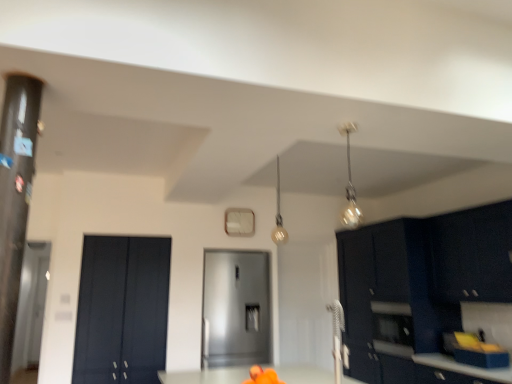
Question: Is matte gold light fixture at upper center, which ranks as the 1th light fixture in back-to-front order, a part of matte black cabinet at left, the 1th door when ordered from left to right?

Choices:
 (A) no
 (B) yes

Answer: (A)

Question: Can you confirm if matte black cabinet at left, the 1th door when ordered from left to right, is shorter than matte gold light fixture at upper center, placed as the 2th light fixture when sorted from front to back?

Choices:
 (A) no
 (B) yes

Answer: (A)

Question: Is matte black cabinet at left, the 1th door when ordered from left to right, facing away from matte gold light fixture at upper center, which ranks as the 1th light fixture in back-to-front order?

Choices:
 (A) yes
 (B) no

Answer: (B)

Question: Is matte black cabinet at left, the 1th door when ordered from left to right, to the left of matte gold light fixture at upper center, placed as the 2th light fixture when sorted from front to back, from the viewer's perspective?

Choices:
 (A) yes
 (B) no

Answer: (A)

Question: From the image's perspective, would you say matte black cabinet at left, the 1th door when ordered from left to right, is shown under matte gold light fixture at upper center, placed as the 2th light fixture when sorted from front to back?

Choices:
 (A) yes
 (B) no

Answer: (A)

Question: Is there a large distance between matte black cabinet at left, the 1th door when ordered from left to right, and matte gold light fixture at upper center, marked as the first light fixture in a left-to-right arrangement?

Choices:
 (A) no
 (B) yes

Answer: (B)

Question: Is glossy dark blue cabinet at upper right, arranged as the 2th cabinetry when viewed from the back, outside transparent glass door at left?

Choices:
 (A) yes
 (B) no

Answer: (A)

Question: Could you tell me if glossy dark blue cabinet at upper right, arranged as the 2th cabinetry when viewed from the back, is turned towards transparent glass door at left?

Choices:
 (A) yes
 (B) no

Answer: (A)

Question: Is glossy dark blue cabinet at upper right, the first cabinetry viewed from the front, to the right of transparent glass door at left from the viewer's perspective?

Choices:
 (A) no
 (B) yes

Answer: (B)

Question: Considering the relative sizes of glossy dark blue cabinet at upper right, the first cabinetry viewed from the front, and transparent glass door at left in the image provided, is glossy dark blue cabinet at upper right, the first cabinetry viewed from the front, thinner than transparent glass door at left?

Choices:
 (A) yes
 (B) no

Answer: (B)

Question: Is glossy dark blue cabinet at upper right, arranged as the 2th cabinetry when viewed from the back, taller than transparent glass door at left?

Choices:
 (A) yes
 (B) no

Answer: (B)

Question: Is glossy dark blue cabinet at upper right, the first cabinetry viewed from the front, with transparent glass door at left?

Choices:
 (A) yes
 (B) no

Answer: (B)

Question: Can you confirm if transparent glass door at left is positioned to the left of matte gold light fixture at upper center, marked as the first light fixture in a left-to-right arrangement?

Choices:
 (A) yes
 (B) no

Answer: (A)